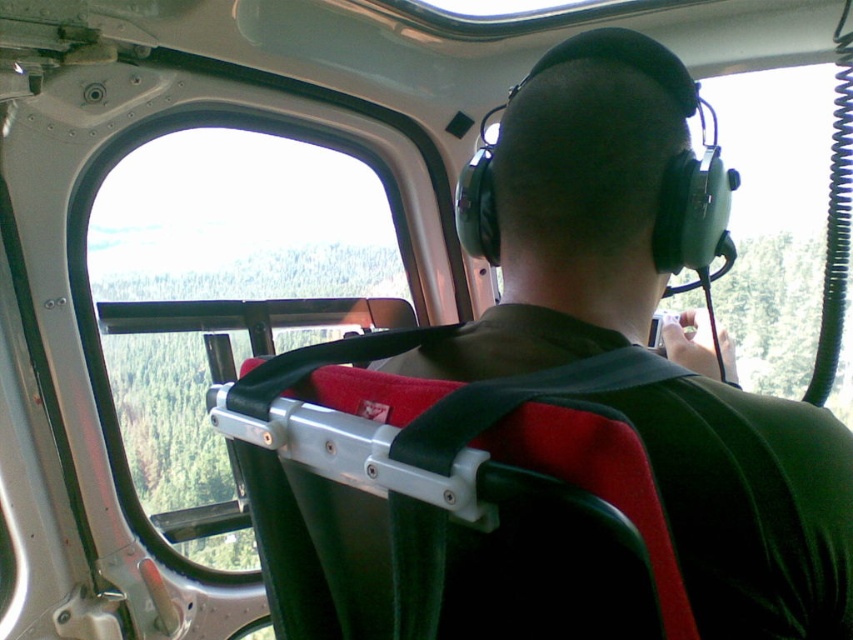
Question: Does transparent glass window at upper left appear under green fabric strap at center?

Choices:
 (A) yes
 (B) no

Answer: (B)

Question: Which object is closer to the camera taking this photo?

Choices:
 (A) green fabric strap at center
 (B) transparent glass window at upper left

Answer: (A)

Question: Can you confirm if transparent glass window at upper left is thinner than green fabric strap at center?

Choices:
 (A) no
 (B) yes

Answer: (A)

Question: Among these points, which one is farthest from the camera?

Choices:
 (A) (117, 248)
 (B) (654, 369)

Answer: (A)

Question: Among these objects, which one is nearest to the camera?

Choices:
 (A) green fabric strap at center
 (B) transparent glass window at upper left

Answer: (A)

Question: Is transparent glass window at upper left bigger than green fabric strap at center?

Choices:
 (A) no
 (B) yes

Answer: (B)